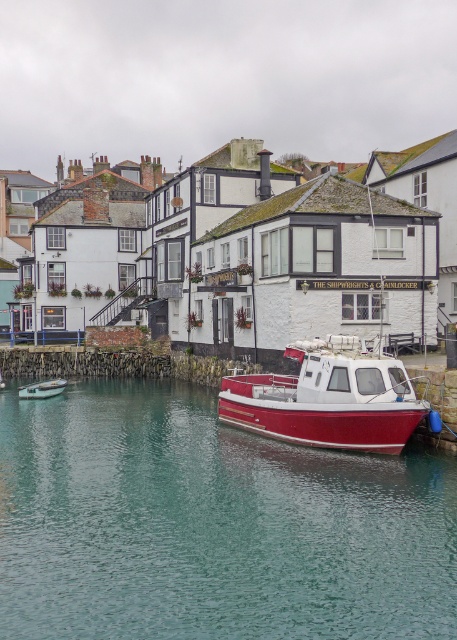
Who is positioned more to the left, teal glossy water at lower center or red matte boat at center?

Positioned to the left is teal glossy water at lower center.

In the scene shown: Can you confirm if teal glossy water at lower center is smaller than red matte boat at center?

Actually, teal glossy water at lower center might be larger than red matte boat at center.

Between point (286, 560) and point (303, 388), which one is positioned behind?

Point (303, 388)

Locate an element on the screen. Image resolution: width=457 pixels, height=640 pixels. teal glossy water at lower center is located at coordinates (212, 525).

Who is shorter, teal glossy water at lower center or metallic silver boat at lower left?

Standing shorter between the two is metallic silver boat at lower left.

I want to click on teal glossy water at lower center, so click(212, 525).

The width and height of the screenshot is (457, 640). In order to click on teal glossy water at lower center in this screenshot , I will do `click(212, 525)`.

Does point (351, 444) lie in front of point (42, 384)?

Yes, point (351, 444) is closer to viewer.

Which is in front, point (314, 410) or point (30, 396)?

Point (314, 410) is in front.

The image size is (457, 640). Identify the location of red matte boat at center. (328, 397).